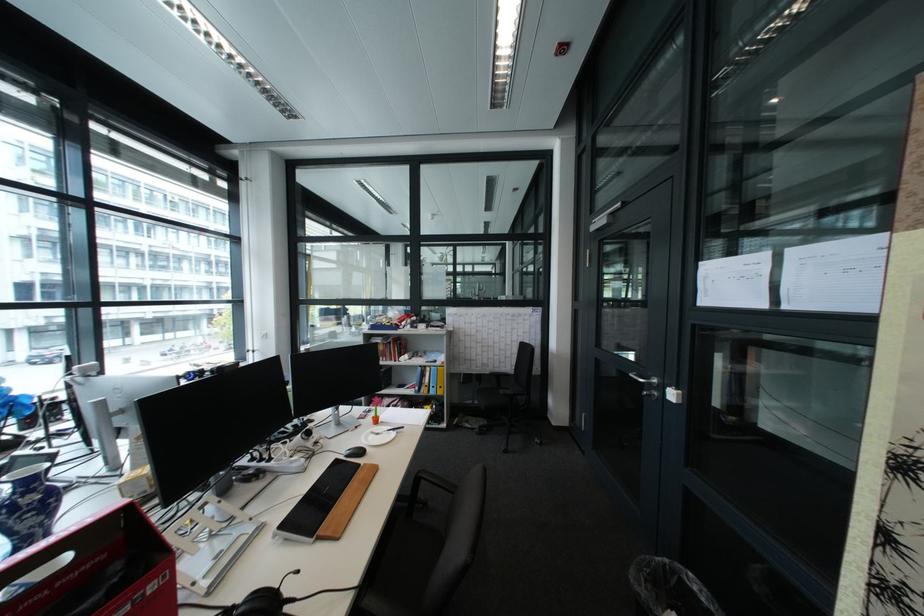
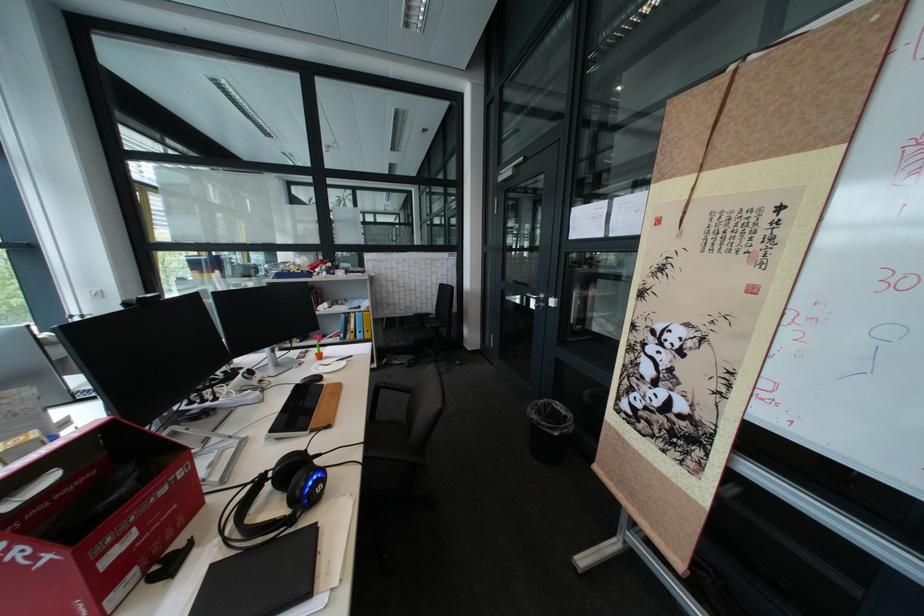
Find the pixel in the second image that matches point (370, 428) in the first image.

(313, 365)